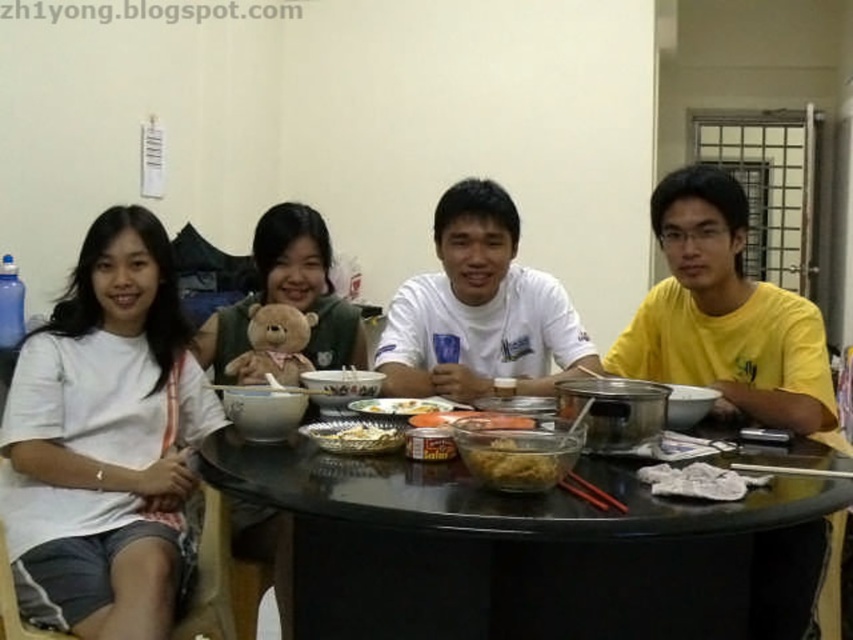
Is black glossy table at center further to camera compared to white cotton shirt at center?

No.

Does black glossy table at center appear on the left side of white cotton shirt at center?

In fact, black glossy table at center is to the right of white cotton shirt at center.

Is point (691, 552) closer to viewer compared to point (483, 300)?

Yes, it is.

Identify the location of black glossy table at center. (512, 550).

Is translucent glass bowl at center wider than smooth plastic container at center?

Indeed, translucent glass bowl at center has a greater width compared to smooth plastic container at center.

From the picture: Who is higher up, translucent glass bowl at center or smooth plastic container at center?

smooth plastic container at center is higher up.

Which is behind, point (552, 460) or point (496, 428)?

Positioned behind is point (496, 428).

You are a GUI agent. You are given a task and a screenshot of the screen. Output one action in this format:
    pyautogui.click(x=<x>, y=<y>)
    Task: Click on the translucent glass bowl at center
    This screenshot has width=853, height=640.
    Given the screenshot: What is the action you would take?
    pyautogui.click(x=515, y=458)

Between white cotton shirt at center and shiny plastic bowl at center, which one is positioned lower?

Result: shiny plastic bowl at center

Measure the distance between point (x=393, y=330) and camera.

Point (x=393, y=330) is 7.31 feet away from camera.

Image resolution: width=853 pixels, height=640 pixels. What do you see at coordinates (479, 308) in the screenshot?
I see `white cotton shirt at center` at bounding box center [479, 308].

Locate an element on the screen. white cotton shirt at center is located at coordinates (479, 308).